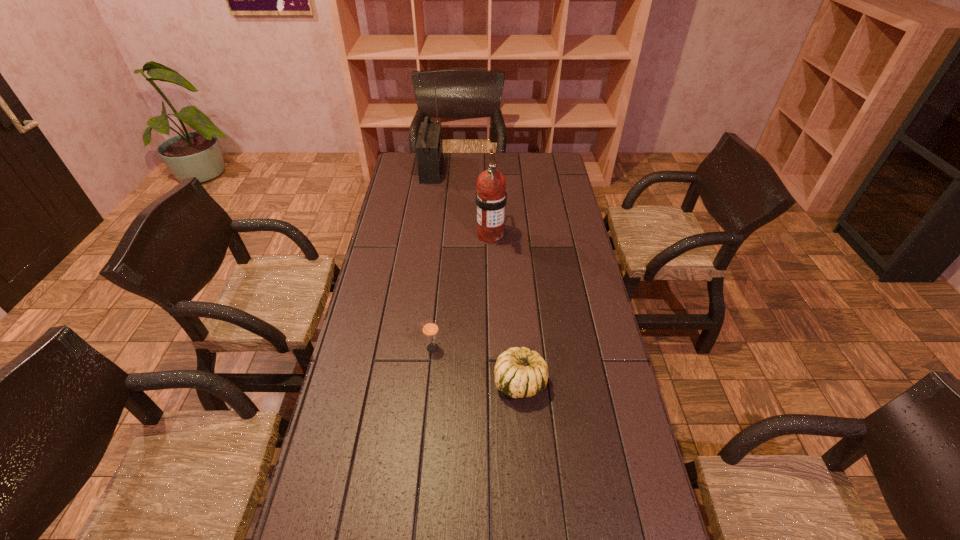
This screenshot has width=960, height=540. Find the location of `vacant space located 0.160m on the right of the nearest object`. vacant space located 0.160m on the right of the nearest object is located at coordinates (602, 382).

This screenshot has height=540, width=960. Identify the location of object located at the far edge. (429, 150).

What are the coordinates of `object that is at the left edge` in the screenshot? It's located at (429, 150).

Find the location of a particular element. object positioned at the far left corner is located at coordinates tap(429, 150).

The width and height of the screenshot is (960, 540). In order to click on free space at the far edge in this screenshot , I will do `click(516, 169)`.

At what (x,y) coordinates should I click in order to perform the action: click on vacant area at the left edge. Please return your answer as a coordinate pair (x, y). This screenshot has width=960, height=540. Looking at the image, I should click on (356, 338).

Identify the location of free space at the right edge. [x=592, y=306].

In the image, there is a desktop. Identify the location of vacant space at the far left corner. This screenshot has height=540, width=960. (407, 177).

The width and height of the screenshot is (960, 540). What are the coordinates of `vacant space that is in between the shortest object and the farthest object` in the screenshot? It's located at (476, 276).

The width and height of the screenshot is (960, 540). What are the coordinates of `unoccupied area between the fire extinguisher and the straw` in the screenshot? It's located at (462, 292).